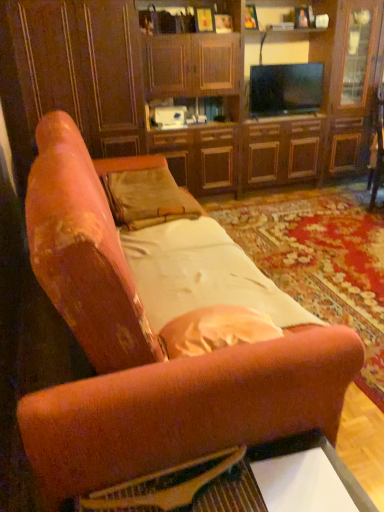
Question: Could you tell me if velvet orange couch at center is turned towards flat-screen tv at upper center?

Choices:
 (A) no
 (B) yes

Answer: (A)

Question: Considering the relative sizes of velvet orange couch at center and flat-screen tv at upper center in the image provided, is velvet orange couch at center shorter than flat-screen tv at upper center?

Choices:
 (A) yes
 (B) no

Answer: (B)

Question: Does velvet orange couch at center have a larger size compared to flat-screen tv at upper center?

Choices:
 (A) yes
 (B) no

Answer: (A)

Question: Is velvet orange couch at center to the left of flat-screen tv at upper center from the viewer's perspective?

Choices:
 (A) no
 (B) yes

Answer: (B)

Question: Would you say velvet orange couch at center is outside flat-screen tv at upper center?

Choices:
 (A) yes
 (B) no

Answer: (A)

Question: Considering the positions of wooden glossy table at lower center and white satin sheet at center in the image, is wooden glossy table at lower center taller or shorter than white satin sheet at center?

Choices:
 (A) short
 (B) tall

Answer: (B)

Question: Considering their positions, is wooden glossy table at lower center located in front of or behind white satin sheet at center?

Choices:
 (A) behind
 (B) front

Answer: (B)

Question: In terms of width, does wooden glossy table at lower center look wider or thinner when compared to white satin sheet at center?

Choices:
 (A) wide
 (B) thin

Answer: (A)

Question: Is point (228, 490) closer or farther from the camera than point (165, 305)?

Choices:
 (A) farther
 (B) closer

Answer: (B)

Question: In the image, is white satin sheet at center positioned in front of or behind wooden guitar at lower center?

Choices:
 (A) behind
 (B) front

Answer: (A)

Question: Considering the positions of white satin sheet at center and wooden guitar at lower center in the image, is white satin sheet at center bigger or smaller than wooden guitar at lower center?

Choices:
 (A) small
 (B) big

Answer: (B)

Question: In terms of width, does white satin sheet at center look wider or thinner when compared to wooden guitar at lower center?

Choices:
 (A) wide
 (B) thin

Answer: (A)

Question: Based on their positions, is white satin sheet at center located to the left or right of wooden guitar at lower center?

Choices:
 (A) right
 (B) left

Answer: (A)

Question: From their relative heights in the image, would you say velvet orange couch at center is taller or shorter than wooden glossy table at lower center?

Choices:
 (A) short
 (B) tall

Answer: (B)

Question: Considering their positions, is velvet orange couch at center located in front of or behind wooden glossy table at lower center?

Choices:
 (A) behind
 (B) front

Answer: (B)